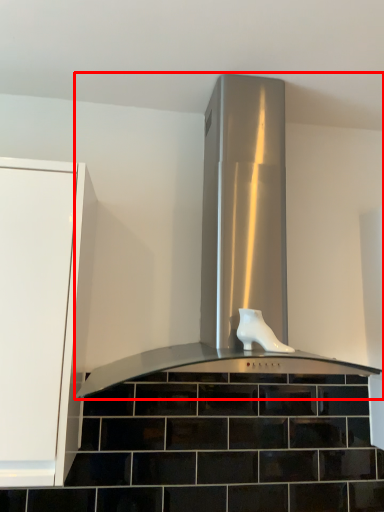
Question: Observing the image, what is the correct spatial positioning of home appliance (annotated by the red box) in reference to footwear?

Choices:
 (A) left
 (B) right

Answer: (A)